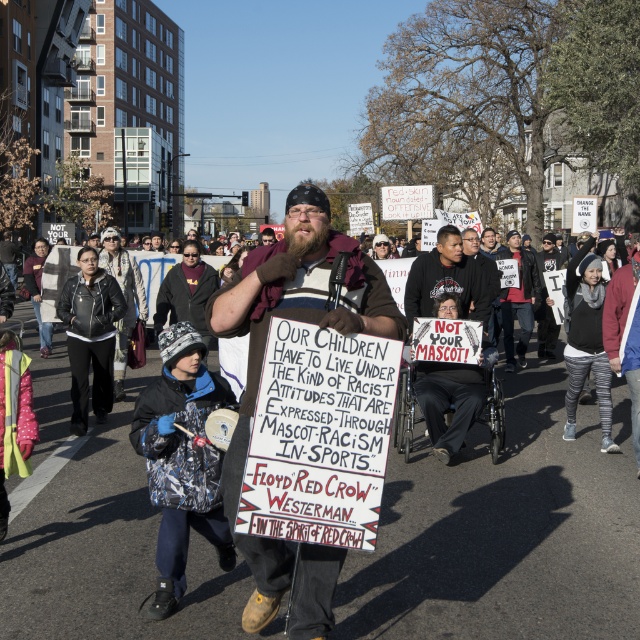
Question: Is brown leather jacket at center to the left of black fabric shirt at center from the viewer's perspective?

Choices:
 (A) no
 (B) yes

Answer: (B)

Question: Which of the following is the farthest from the observer?

Choices:
 (A) (248, 417)
 (B) (452, 387)

Answer: (B)

Question: Among these objects, which one is farthest from the camera?

Choices:
 (A) brown leather jacket at center
 (B) black fabric shirt at center

Answer: (B)

Question: Which object is farther from the camera taking this photo?

Choices:
 (A) brown leather jacket at center
 (B) black fabric shirt at center

Answer: (B)

Question: From the image, what is the correct spatial relationship of brown leather jacket at center in relation to black fabric shirt at center?

Choices:
 (A) right
 (B) left

Answer: (B)

Question: Is brown leather jacket at center wider than black fabric shirt at center?

Choices:
 (A) no
 (B) yes

Answer: (B)